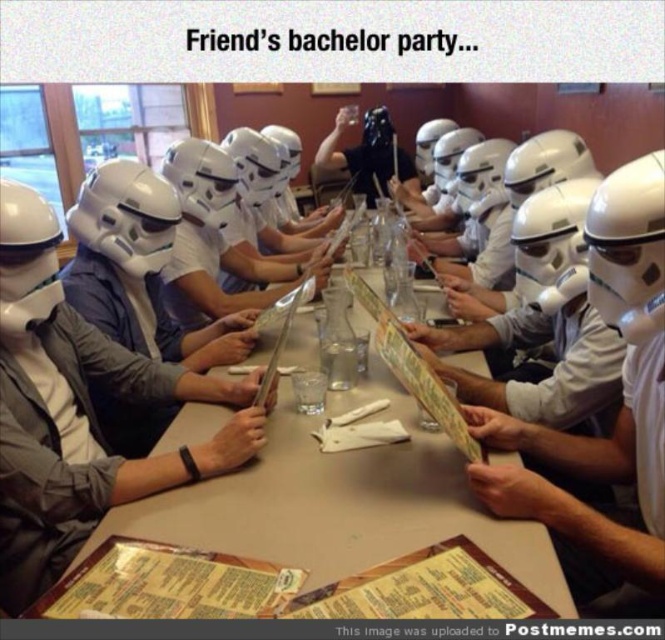
Question: Which point is closer to the camera?

Choices:
 (A) (94, 532)
 (B) (120, 348)

Answer: (A)

Question: Is the position of white plastic table at center less distant than that of white matte helmet at center?

Choices:
 (A) yes
 (B) no

Answer: (A)

Question: Among these objects, which one is nearest to the camera?

Choices:
 (A) matte black helmet at center
 (B) white plastic table at center
 (C) white matte helmet at center

Answer: (B)

Question: Considering the relative positions of white matte helmet at center and matte black helmet at center in the image provided, where is white matte helmet at center located with respect to matte black helmet at center?

Choices:
 (A) right
 (B) left

Answer: (B)

Question: Which object is closer to the camera taking this photo?

Choices:
 (A) matte black helmet at center
 (B) white plastic table at center

Answer: (B)

Question: Is white plastic table at center closer to the viewer compared to white matte helmet at center?

Choices:
 (A) no
 (B) yes

Answer: (B)